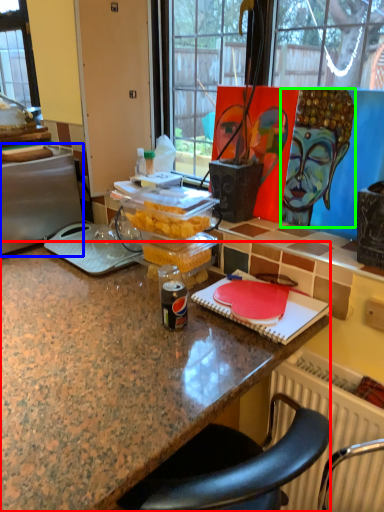
Question: Considering the real-world distances, which object is closest to desk (highlighted by a red box)? appliance (highlighted by a blue box) or person (highlighted by a green box).

Choices:
 (A) appliance
 (B) person

Answer: (A)